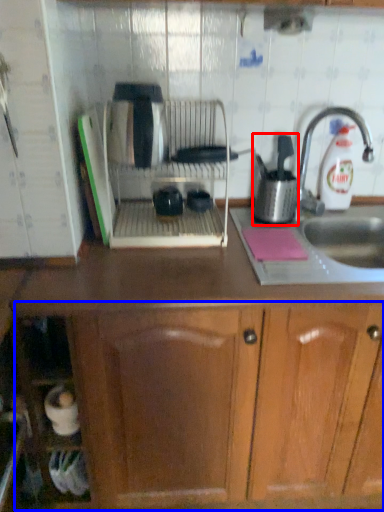
Question: Among these objects, which one is nearest to the camera, kitchen appliance (highlighted by a red box) or drawer (highlighted by a blue box)?

Choices:
 (A) kitchen appliance
 (B) drawer

Answer: (B)